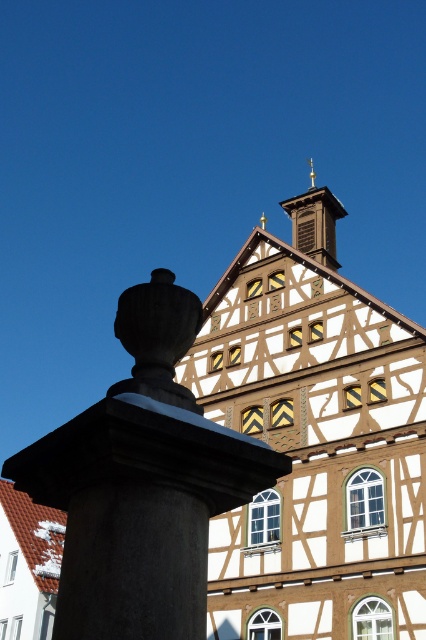
Can you confirm if smooth stone column at left is bigger than wooden bell tower at upper center?

Correct, smooth stone column at left is larger in size than wooden bell tower at upper center.

Between point (72, 436) and point (319, 244), which one is positioned in front?

Point (72, 436) is in front.

The width and height of the screenshot is (426, 640). What do you see at coordinates (141, 483) in the screenshot?
I see `smooth stone column at left` at bounding box center [141, 483].

Where is `smooth stone column at left`? smooth stone column at left is located at coordinates (141, 483).